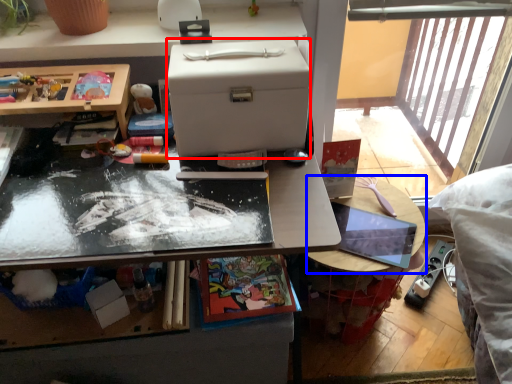
Question: Which point is closer to the camera, box (highlighted by a red box) or table (highlighted by a blue box)?

Choices:
 (A) box
 (B) table

Answer: (A)